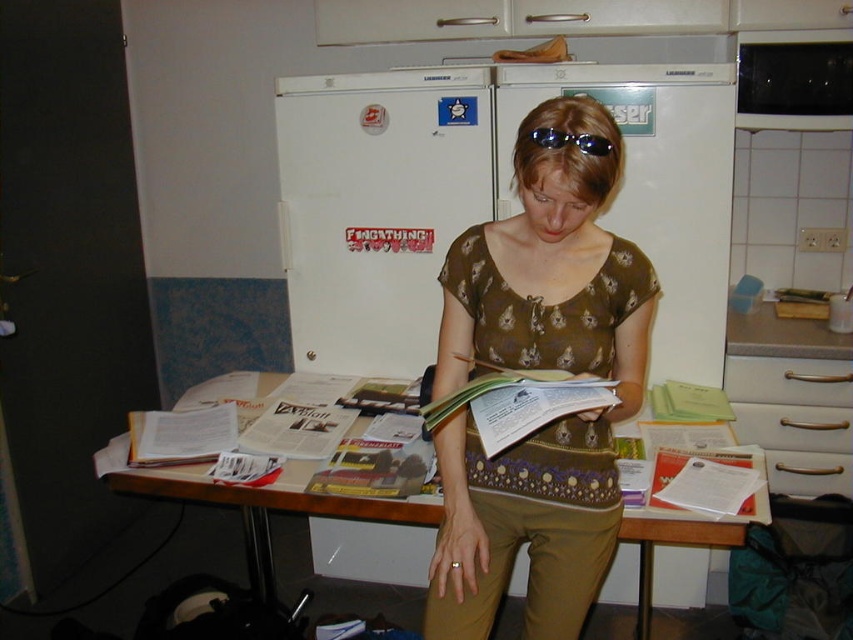
Question: Which object is the closest to the sunglasses at center?

Choices:
 (A) green paper book at center
 (B) brown printed shirt at center
 (C) white paper book at center

Answer: (A)

Question: Among these points, which one is nearest to the camera?

Choices:
 (A) (773, 401)
 (B) (281, 486)

Answer: (B)

Question: Does silver metallic drawer at right have a lesser width compared to white matte drawer at lower right?

Choices:
 (A) no
 (B) yes

Answer: (A)

Question: Is wooden table at center positioned behind sunglasses at center?

Choices:
 (A) no
 (B) yes

Answer: (B)

Question: Does green paper book at center have a smaller size compared to white paper book at center?

Choices:
 (A) yes
 (B) no

Answer: (B)

Question: Which object appears closest to the camera in this image?

Choices:
 (A) white paper book at center
 (B) green paper book at center

Answer: (B)